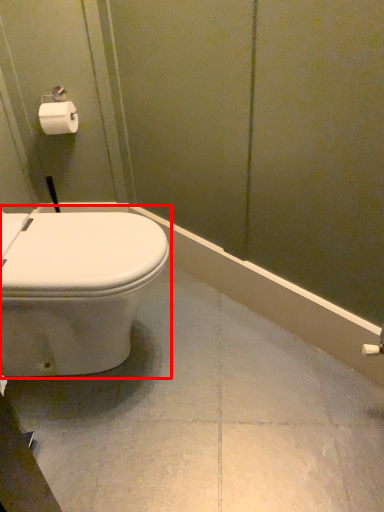
Question: From the image's perspective, what is the correct spatial positioning of toilet (annotated by the red box) in reference to toilet paper?

Choices:
 (A) above
 (B) below

Answer: (B)